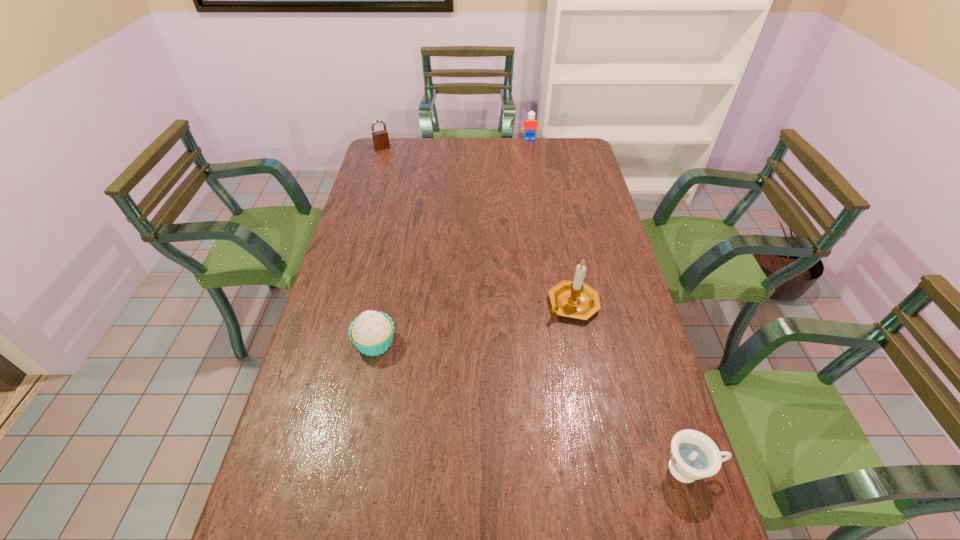
This screenshot has width=960, height=540. Find the location of `unoccupied position between the shortest object and the leftmost object`. unoccupied position between the shortest object and the leftmost object is located at coordinates (536, 308).

You are a GUI agent. You are given a task and a screenshot of the screen. Output one action in this format:
    pyautogui.click(x=<x>, y=<y>)
    Task: Click on the empty space that is in between the fourth object from right to left and the nearest object
    
    Given the screenshot: What is the action you would take?
    [533, 406]

Locate which object ranks fourth in proximity to the fourth nearest object. Please provide its 2D coordinates. Your answer should be formatted as a tuple, i.e. [(x, y)], where the tuple contains the x and y coordinates of a point satisfying the conditions above.

[(693, 456)]

I want to click on the closest object to the rightmost object, so coord(575,299).

Locate an element on the screen. The image size is (960, 540). free space that satisfies the following two spatial constraints: 1. on the front side of the third farthest object; 2. on the side of the shortest object with the handle is located at coordinates (604, 469).